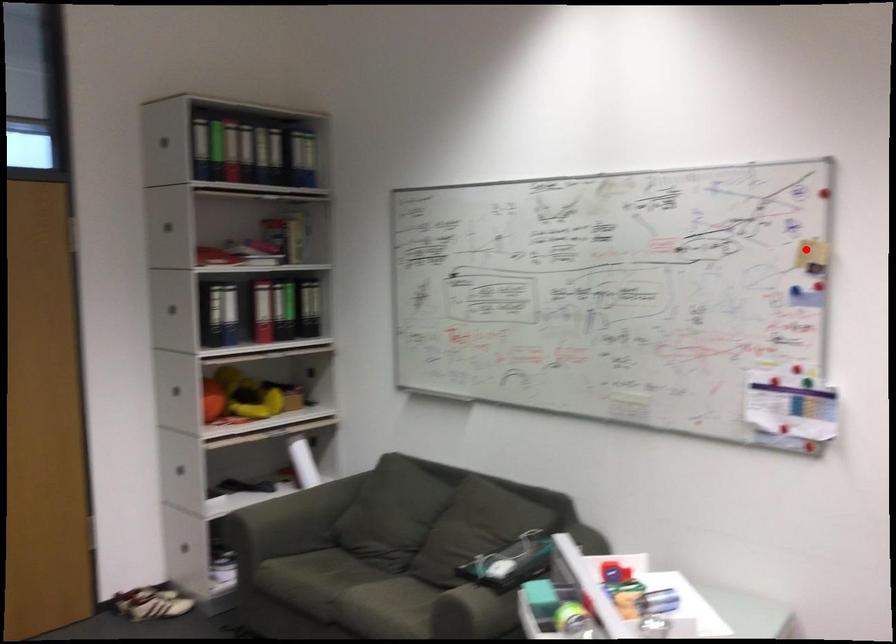
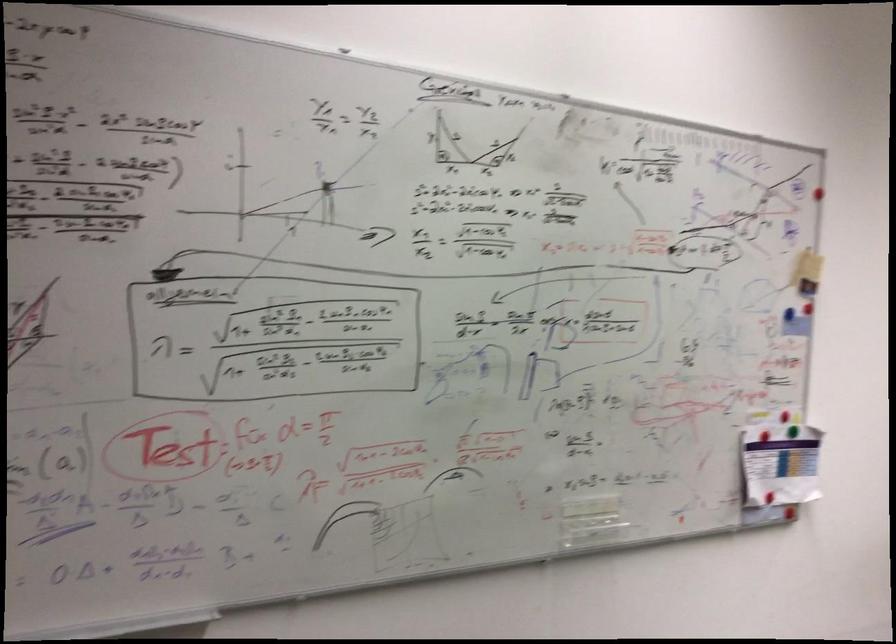
Question: A red point is marked in image1. In image2, is the corresponding 3D point closer to the camera or farther? Reply with the corresponding letter.

Choices:
 (A) The corresponding 3D point is closer.
 (B) The corresponding 3D point is farther.

Answer: (A)